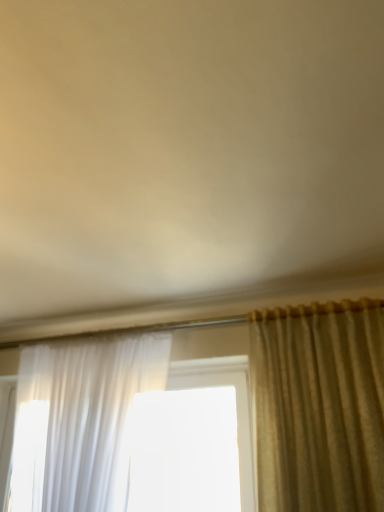
Question: Is silky beige curtain at right, placed as the 2th curtain when sorted from left to right, taller or shorter than sheer white curtain at left, acting as the 1th curtain starting from the left?

Choices:
 (A) tall
 (B) short

Answer: (B)

Question: Is silky beige curtain at right, arranged as the 1th curtain when viewed from the right, inside the boundaries of sheer white curtain at left, acting as the 1th curtain starting from the left, or outside?

Choices:
 (A) outside
 (B) inside

Answer: (A)

Question: From the image's perspective, is silky beige curtain at right, placed as the 2th curtain when sorted from left to right, positioned above or below sheer white curtain at left, the second curtain from the right?

Choices:
 (A) below
 (B) above

Answer: (B)

Question: Considering the positions of point (26, 392) and point (259, 457), is point (26, 392) closer or farther from the camera than point (259, 457)?

Choices:
 (A) farther
 (B) closer

Answer: (A)

Question: In the image, is sheer white curtain at left, the second curtain from the right, positioned in front of or behind silky beige curtain at right, placed as the 2th curtain when sorted from left to right?

Choices:
 (A) behind
 (B) front

Answer: (A)

Question: Is sheer white curtain at left, acting as the 1th curtain starting from the left, spatially inside silky beige curtain at right, placed as the 2th curtain when sorted from left to right, or outside of it?

Choices:
 (A) inside
 (B) outside

Answer: (B)

Question: Based on their positions, is sheer white curtain at left, acting as the 1th curtain starting from the left, located to the left or right of silky beige curtain at right, arranged as the 1th curtain when viewed from the right?

Choices:
 (A) right
 (B) left

Answer: (B)